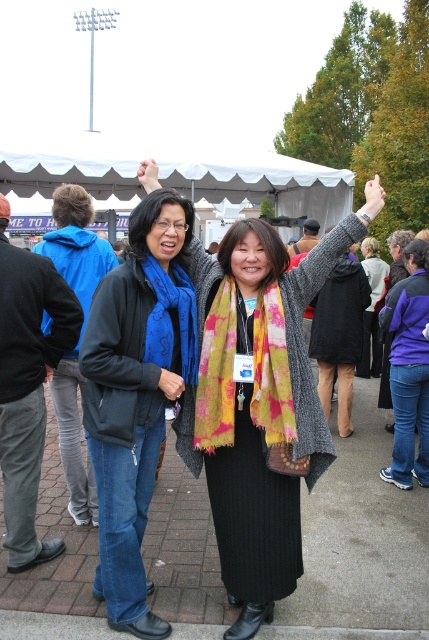
Is blue fleece jacket at center behind blue woven scarf at center?

No, blue fleece jacket at center is closer to the viewer.

Can you confirm if blue fleece jacket at center is positioned to the right of blue woven scarf at center?

Incorrect, blue fleece jacket at center is not on the right side of blue woven scarf at center.

Between point (160, 394) and point (154, 282), which one is positioned in front?

Point (154, 282) is more forward.

The width and height of the screenshot is (429, 640). Find the location of `blue fleece jacket at center`. blue fleece jacket at center is located at coordinates (135, 394).

Can you confirm if multicolored scarf at center is wider than tie-dye wool scarf at center?

Correct, the width of multicolored scarf at center exceeds that of tie-dye wool scarf at center.

In the scene shown: Does multicolored scarf at center have a larger size compared to tie-dye wool scarf at center?

Indeed, multicolored scarf at center has a larger size compared to tie-dye wool scarf at center.

What do you see at coordinates (259, 397) in the screenshot? The width and height of the screenshot is (429, 640). I see `multicolored scarf at center` at bounding box center [259, 397].

Find the location of a particular element. This screenshot has height=640, width=429. multicolored scarf at center is located at coordinates (259, 397).

Is tie-dye wool scarf at center positioned behind blue woven scarf at center?

No.

Which is above, tie-dye wool scarf at center or blue woven scarf at center?

Positioned higher is blue woven scarf at center.

Measure the distance between point (256, 353) and camera.

Point (256, 353) is 2.43 meters from camera.

This screenshot has width=429, height=640. I want to click on tie-dye wool scarf at center, so click(217, 372).